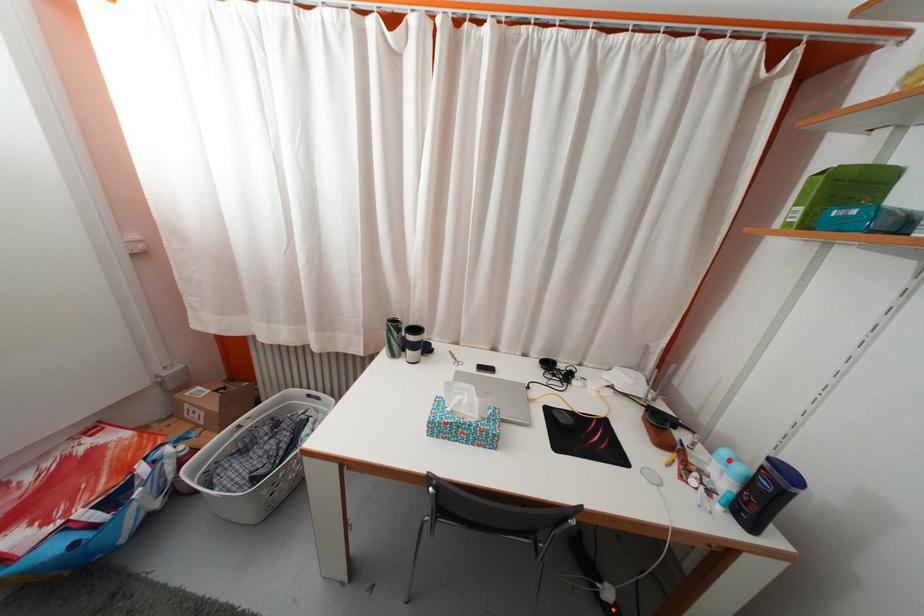
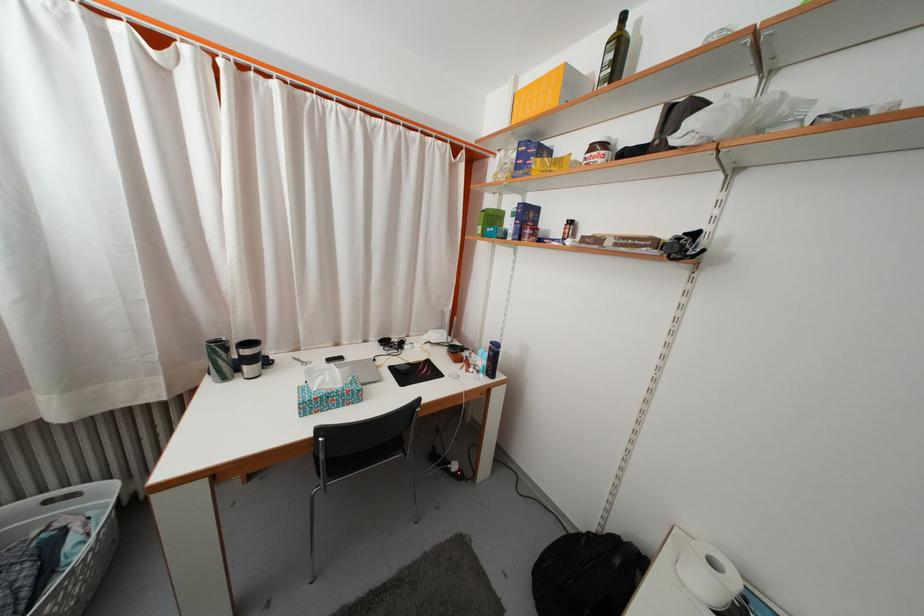
Question: A red point is marked in image1. In image2, is the corresponding 3D point closer to the camera or farther? Reply with the corresponding letter.

Choices:
 (A) The corresponding 3D point is closer.
 (B) The corresponding 3D point is farther.

Answer: (A)